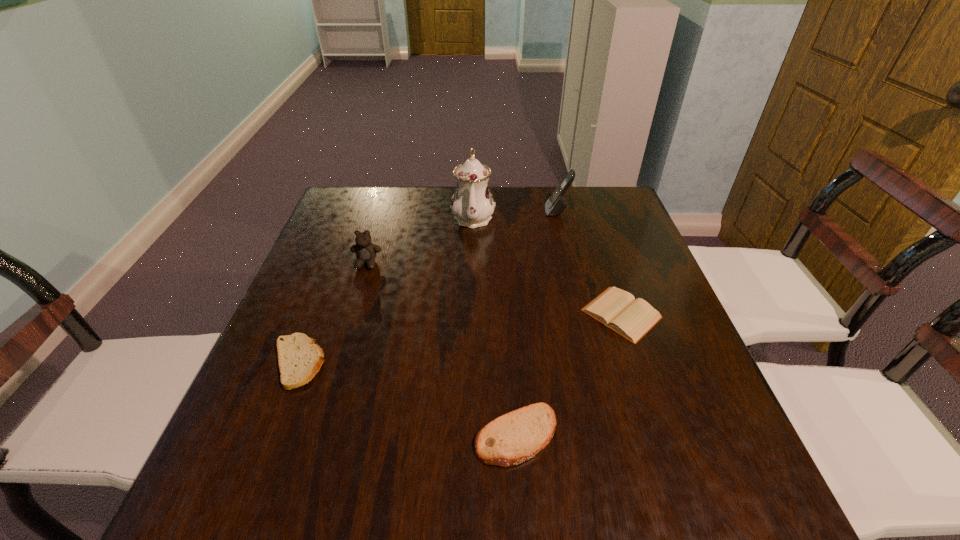
Where is `chinaware`? Image resolution: width=960 pixels, height=540 pixels. chinaware is located at coordinates (472, 205).

This screenshot has height=540, width=960. Identify the location of the second tallest object. (555, 205).

Where is `teddy bear`? This screenshot has height=540, width=960. teddy bear is located at coordinates (366, 252).

Where is `the fourth shortest object`? the fourth shortest object is located at coordinates (366, 252).

Where is `the right pita bread`? The width and height of the screenshot is (960, 540). the right pita bread is located at coordinates (513, 438).

At what (x,y) coordinates should I click in order to perform the action: click on the third shortest object. Please return your answer as a coordinate pair (x, y). Image resolution: width=960 pixels, height=540 pixels. Looking at the image, I should click on (513, 438).

This screenshot has height=540, width=960. In order to click on the farther pita bread in this screenshot , I will do `click(300, 359)`.

I want to click on the left pita bread, so click(300, 359).

The image size is (960, 540). In order to click on diary in this screenshot , I will do `click(617, 309)`.

At what (x,y) coordinates should I click in order to perform the action: click on free space located 0.160m on the front of the tallest object. Please return your answer as a coordinate pair (x, y). The height and width of the screenshot is (540, 960). Looking at the image, I should click on pos(471,273).